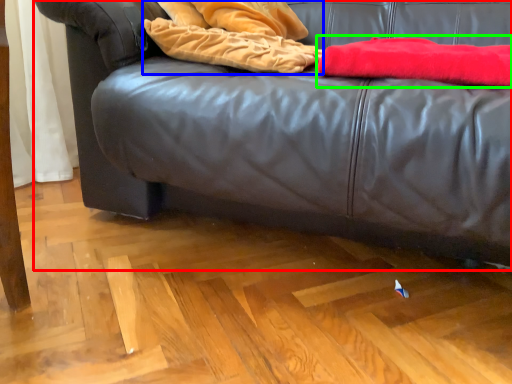
Question: Which object is the closest to the studio couch (highlighted by a red box)? Choose among these: blanket (highlighted by a blue box) or blanket (highlighted by a green box).

Choices:
 (A) blanket
 (B) blanket

Answer: (A)